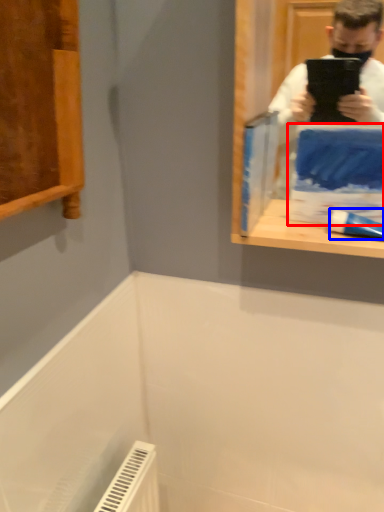
Question: Which point is closer to the camera, paperback book (highlighted by a red box) or toothpaste (highlighted by a blue box)?

Choices:
 (A) paperback book
 (B) toothpaste

Answer: (A)